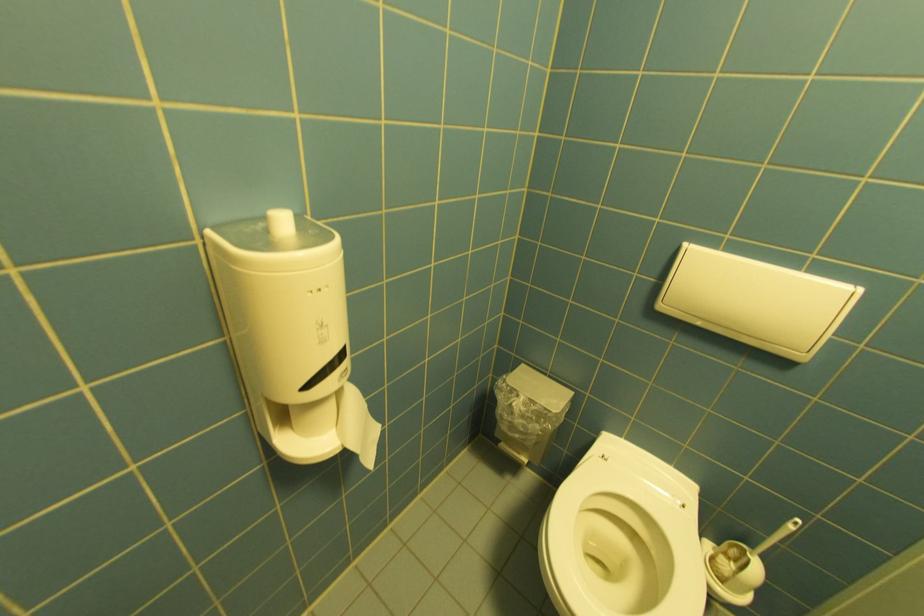
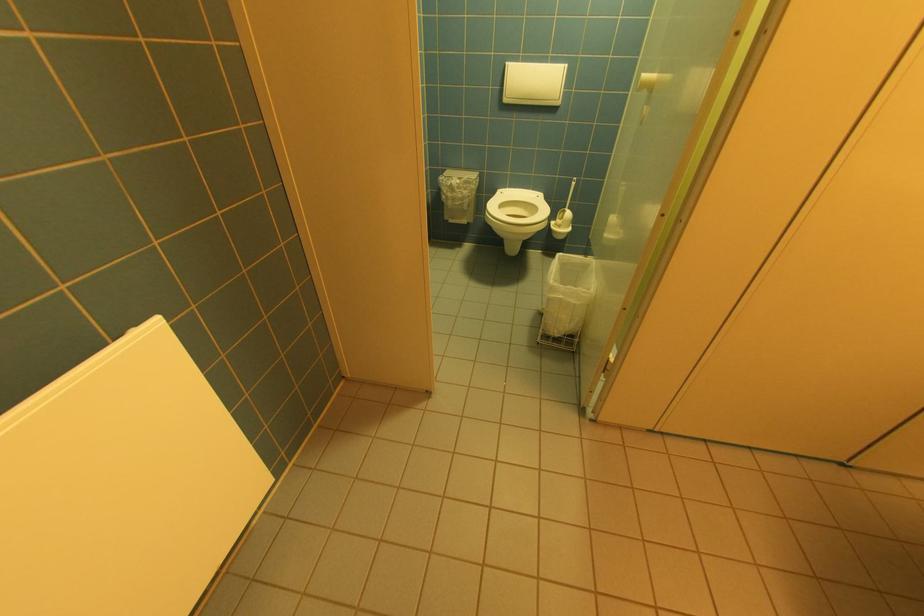
Find the pixel in the second image that matches (x=742, y=552) in the first image.

(567, 215)